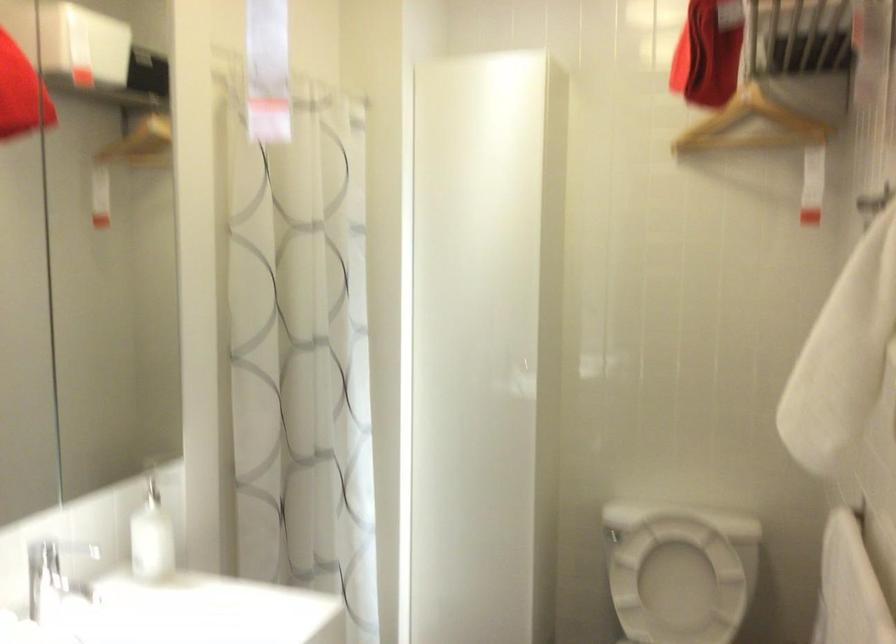
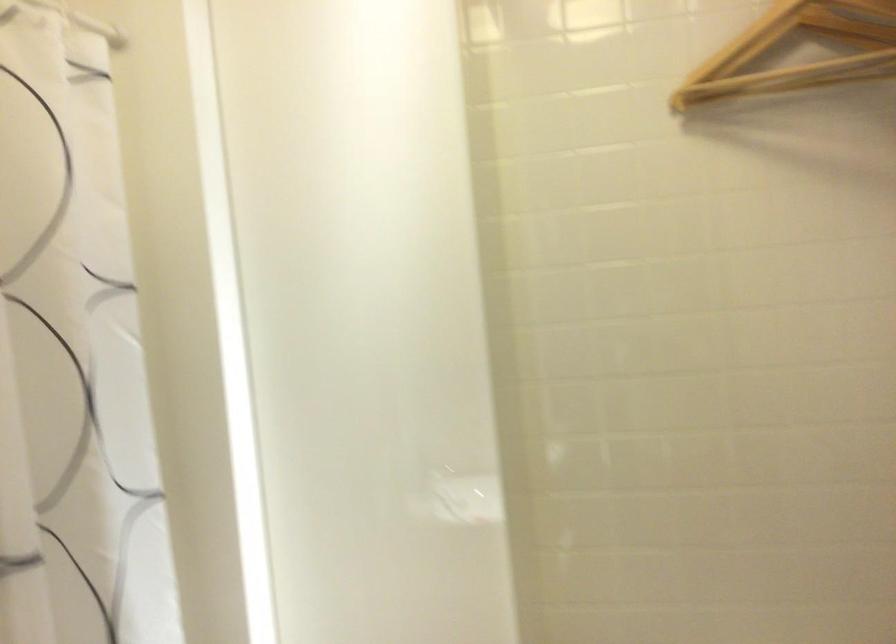
Question: What movement of the cameraman would produce the second image?

Choices:
 (A) Left
 (B) Right
 (C) Forward
 (D) Backward

Answer: (C)